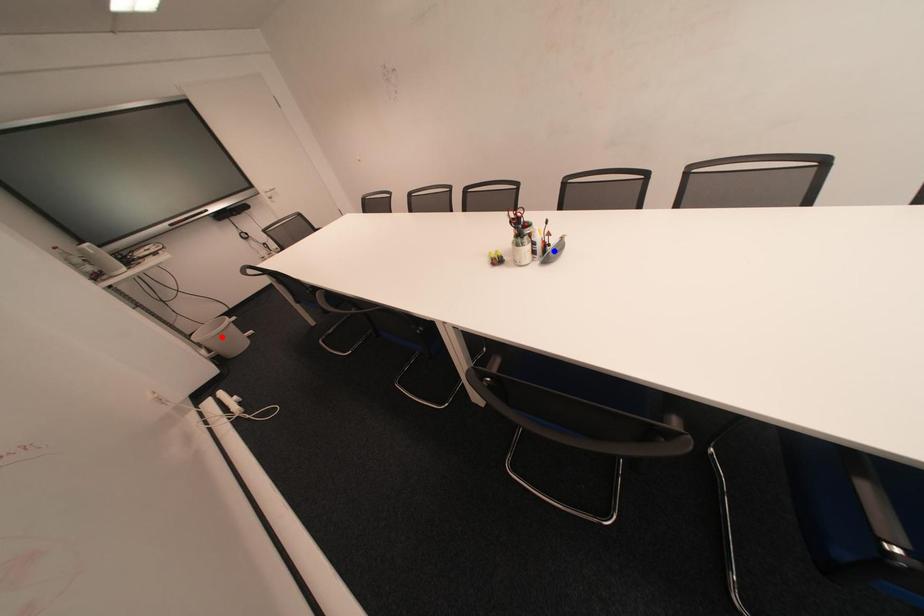
Question: Two points are marked on the image. Which point is closer to the camera?

Choices:
 (A) Blue point is closer.
 (B) Red point is closer.

Answer: (A)